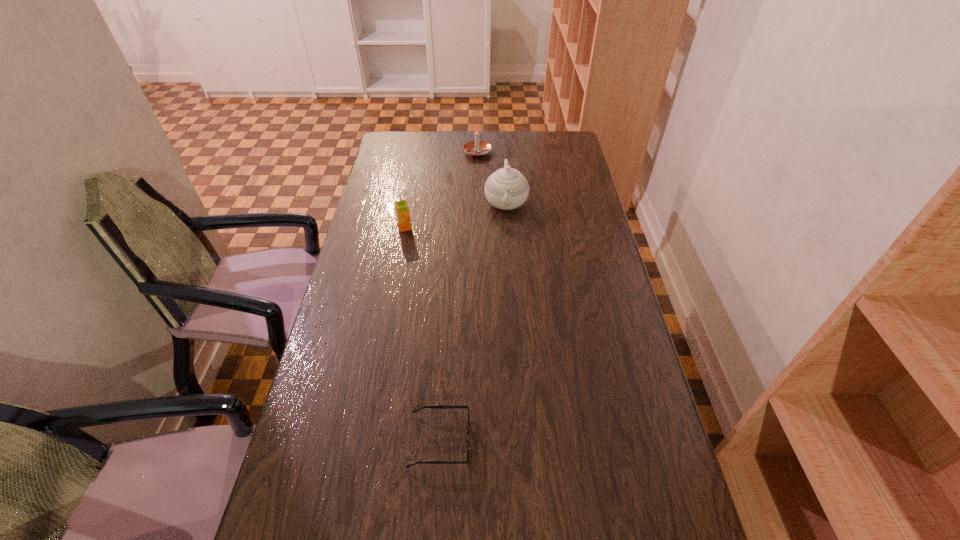
Image resolution: width=960 pixels, height=540 pixels. Identify the location of the tallest object. (506, 188).

In order to click on the third nearest object in this screenshot , I will do `click(506, 188)`.

Identify the location of the farthest object. Image resolution: width=960 pixels, height=540 pixels. (477, 148).

Identify the location of the second nearest object. The width and height of the screenshot is (960, 540). (401, 207).

You are a GUI agent. You are given a task and a screenshot of the screen. Output one action in this format:
    pyautogui.click(x=<x>, y=<y>)
    Task: Click on the leftmost object
    Image resolution: width=960 pixels, height=540 pixels.
    Given the screenshot: What is the action you would take?
    pyautogui.click(x=401, y=207)

At what (x,y) coordinates should I click in order to perform the action: click on the shortest object. Please return your answer as a coordinate pair (x, y). Image resolution: width=960 pixels, height=540 pixels. Looking at the image, I should click on (429, 406).

Locate an element on the screen. This screenshot has width=960, height=540. the nearest object is located at coordinates (429, 406).

Find the location of a particular element. vacant area situated 0.370m on the spout of the tallest object is located at coordinates (513, 298).

This screenshot has height=540, width=960. Identify the location of vacant space located on the left of the farthest object. (382, 152).

Where is `free location located 0.320m on the front of the leftmost object`? free location located 0.320m on the front of the leftmost object is located at coordinates (392, 300).